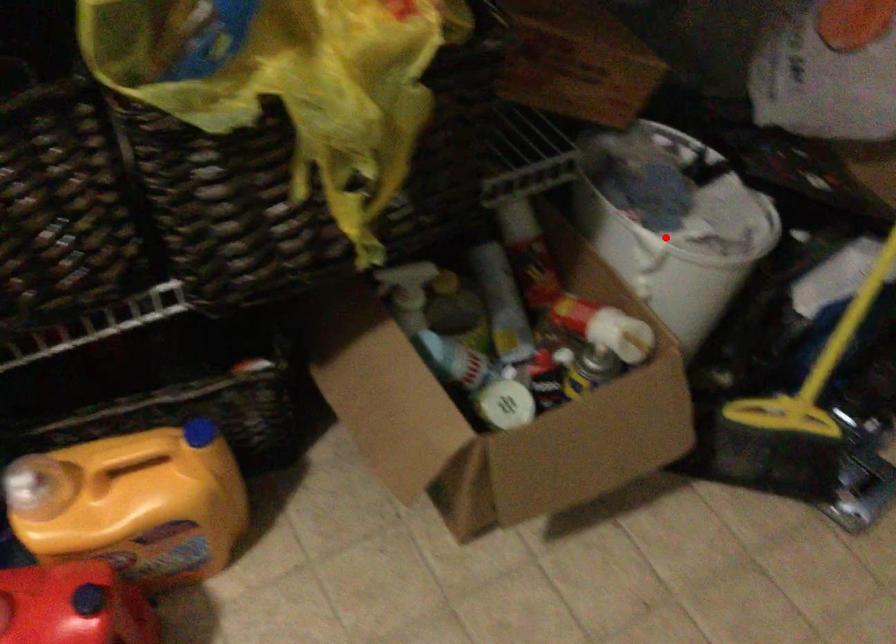
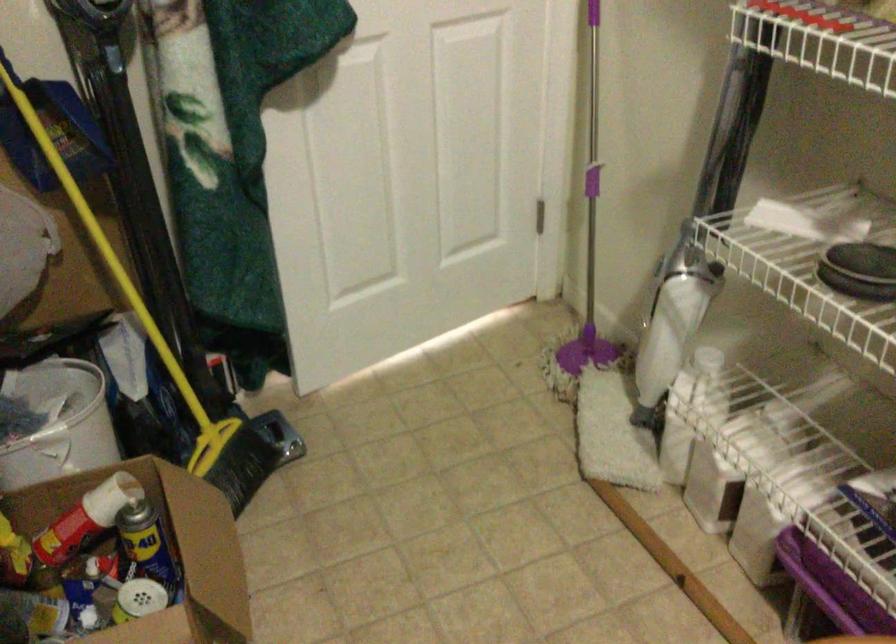
The point at the highlighted location is marked in the first image. Where is the corresponding point in the second image?

(58, 422)